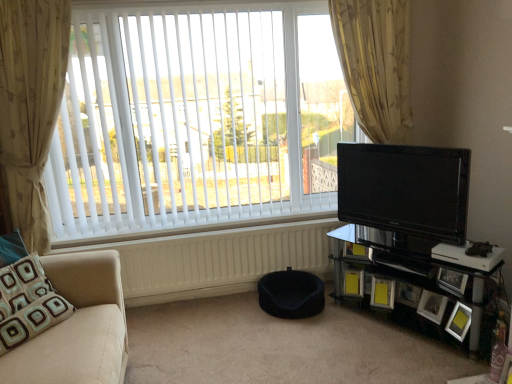
At what (x,y) coordinates should I click in order to perform the action: click on vacant space situated on the left part of yellow matte picture frame at lower right, positioned as the 6th picture frame in left-to-right order. Please return your answer as a coordinate pair (x, y). This screenshot has height=384, width=512. Looking at the image, I should click on (436, 336).